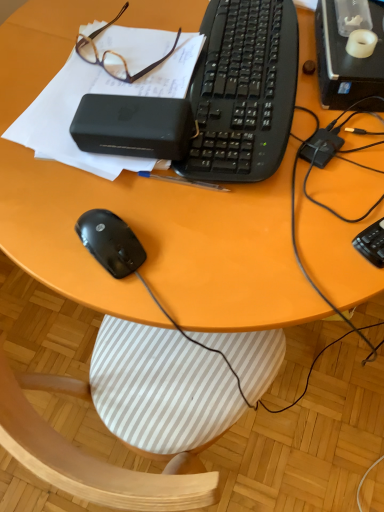
What are the coordinates of `empty space that is in between black plastic keyboard at right, placed as the second computer keyboard when sorted from back to front, and black plastic power bank at upper center` in the screenshot? It's located at (287, 198).